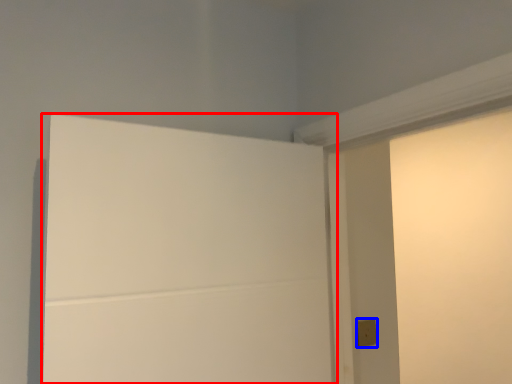
Question: Which of the following is the farthest to the observer, door (highlighted by a red box) or light switch (highlighted by a blue box)?

Choices:
 (A) door
 (B) light switch

Answer: (B)